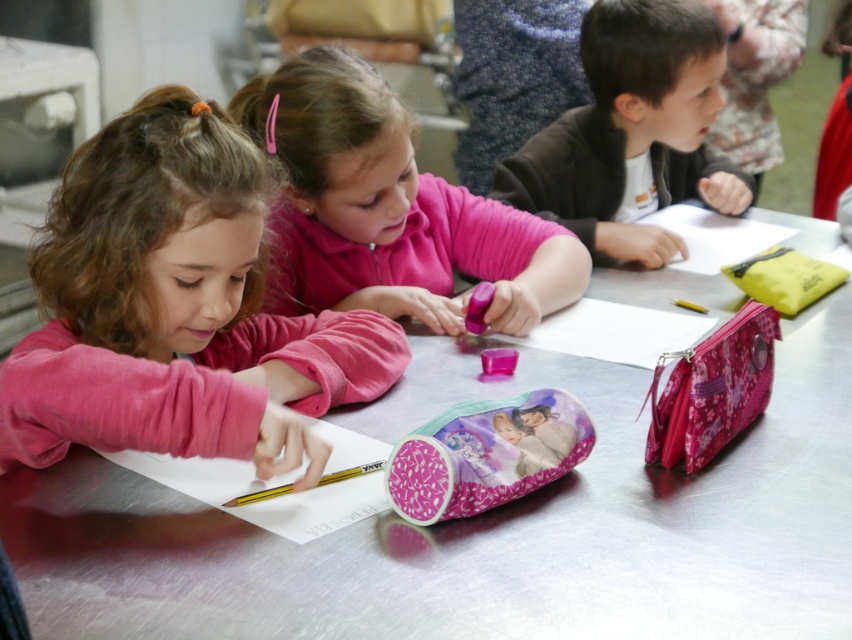
You are a teacher in a classroom. You need to place a new poster on the wall directly above the metallic silver table at center. Where should you place the poster?

The poster should be placed directly above the metallic silver table at center, which is located at coordinates point (482, 525).

You are a teacher organizing a classroom. You need to place a new poster on the wall behind the metallic silver table at center and the pink fabric child at center. Which object should you position closer to the wall to ensure the poster can be easily viewed by both?

The metallic silver table at center is larger in size than the pink fabric child at center, so positioning the table closer to the wall would allow the poster to be easily viewed by both.

You are a teacher observing the children at the table. You need to locate the pink matte pencil case at center and the matte black jacket at upper right. Which object is positioned closer to the left side of the table?

The pink matte pencil case at center is to the left of the matte black jacket at upper right, so it is closer to the left side of the table.